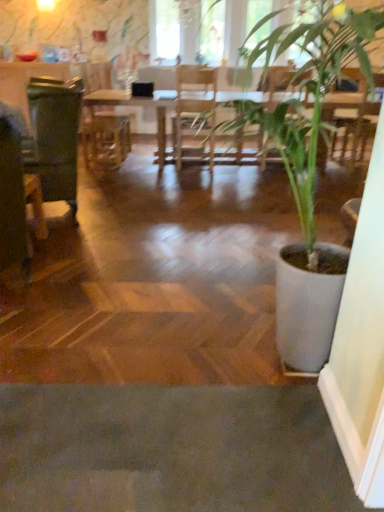
Question: Can you confirm if green leafy plant at center is wider than green matte swivel chair at left?

Choices:
 (A) yes
 (B) no

Answer: (A)

Question: Does green leafy plant at center have a lesser width compared to green matte swivel chair at left?

Choices:
 (A) yes
 (B) no

Answer: (B)

Question: Does green leafy plant at center appear on the left side of green matte swivel chair at left?

Choices:
 (A) no
 (B) yes

Answer: (A)

Question: Is there a large distance between green leafy plant at center and green matte swivel chair at left?

Choices:
 (A) no
 (B) yes

Answer: (B)

Question: Is green leafy plant at center behind green matte swivel chair at left?

Choices:
 (A) no
 (B) yes

Answer: (A)

Question: Considering the relative sizes of green leafy plant at center and green matte swivel chair at left in the image provided, is green leafy plant at center shorter than green matte swivel chair at left?

Choices:
 (A) no
 (B) yes

Answer: (A)

Question: From a real-world perspective, is wooden table at center located higher than green leafy plant at center?

Choices:
 (A) no
 (B) yes

Answer: (A)

Question: Is wooden table at center thinner than green leafy plant at center?

Choices:
 (A) no
 (B) yes

Answer: (B)

Question: Can green leafy plant at center be found inside wooden table at center?

Choices:
 (A) no
 (B) yes

Answer: (A)

Question: Is wooden table at center completely or partially outside of green leafy plant at center?

Choices:
 (A) yes
 (B) no

Answer: (A)

Question: From a real-world perspective, is wooden table at center under green leafy plant at center?

Choices:
 (A) yes
 (B) no

Answer: (A)

Question: Is wooden table at center smaller than green leafy plant at center?

Choices:
 (A) yes
 (B) no

Answer: (B)

Question: Is the position of wooden armchair at center more distant than that of green leafy plant at center?

Choices:
 (A) no
 (B) yes

Answer: (B)